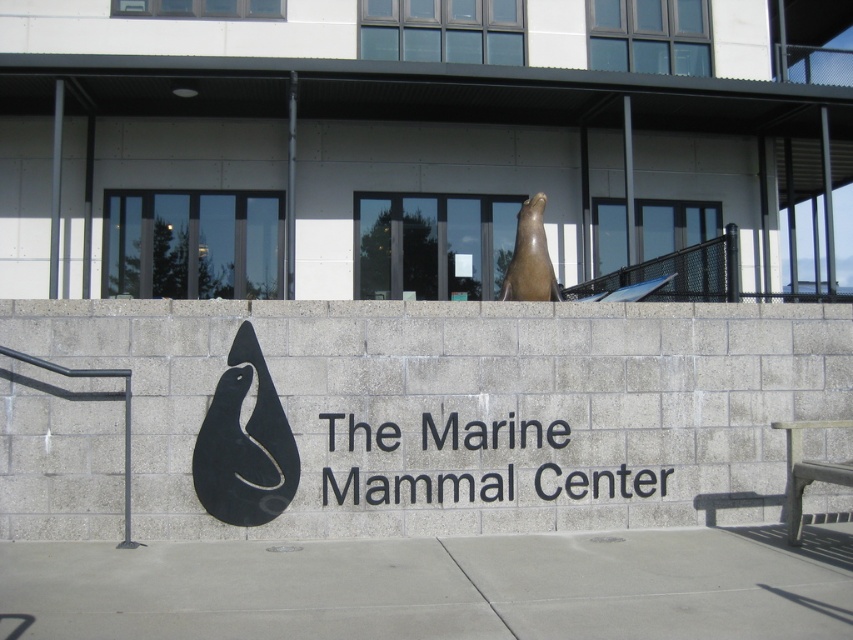
Question: Where is black matte sculpture at center located in relation to smooth gray bench at lower right in the image?

Choices:
 (A) right
 (B) left

Answer: (B)

Question: Which object is positioned closest to the brown polished stone seal at center?

Choices:
 (A) black matte sculpture at center
 (B) smooth gray bench at lower right
 (C) black mesh railing at upper center

Answer: (C)

Question: Does black matte sculpture at center appear on the right side of black mesh railing at upper center?

Choices:
 (A) yes
 (B) no

Answer: (B)

Question: Based on their relative distances, which object is nearer to the smooth gray bench at lower right?

Choices:
 (A) brown polished stone seal at center
 (B) black mesh railing at upper center

Answer: (B)

Question: Does black matte sculpture at center have a larger size compared to smooth gray bench at lower right?

Choices:
 (A) yes
 (B) no

Answer: (B)

Question: Which point is farther to the camera?

Choices:
 (A) brown polished stone seal at center
 (B) black mesh railing at upper center
 (C) black matte sculpture at center

Answer: (A)